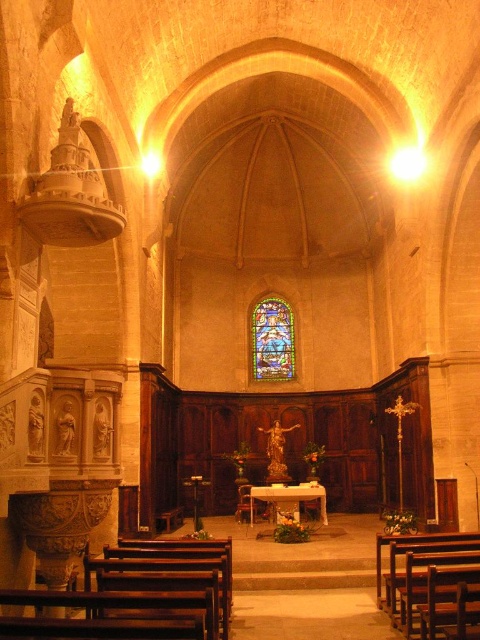
You are an architect designing a new church and want to ensure the stained glass window at center and the white marble altar at center are proportionate. Based on the image, which object is narrower?

The stained glass window at center is narrower than the white marble altar at center because its width is less than the altar.

Consider the image. You are an architect designing a new church. You want to install a new cross that is 3 meters tall. The stained glass window at center and the white marble altar at center are both in the central area. Which object should you place the cross next to so it doesn

The stained glass window at center is taller than the white marble altar at center, so placing the cross next to the stained glass window at center would provide a better proportional fit since the cross is 3 meters tall.